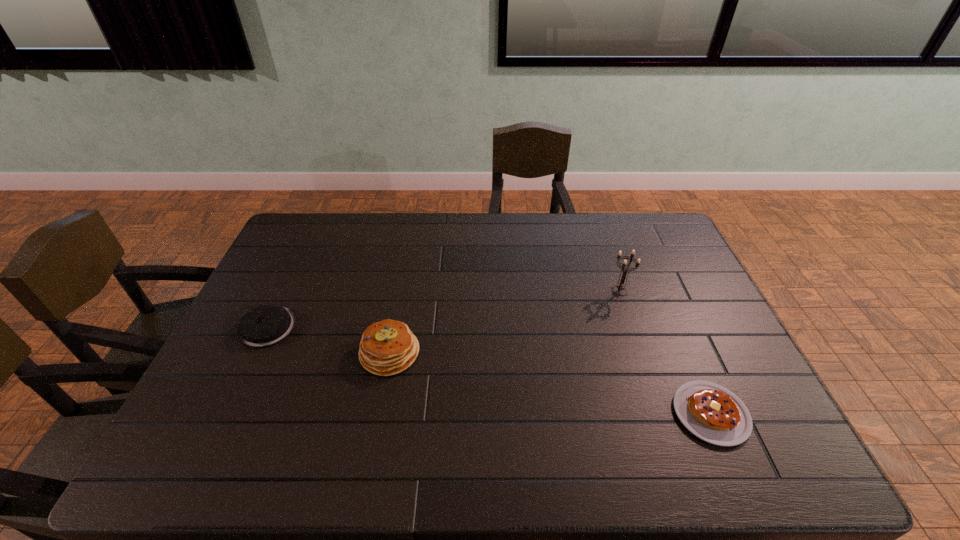
In the image, there is a desktop. Where is `free space at the far left corner`? This screenshot has height=540, width=960. free space at the far left corner is located at coordinates tap(319, 215).

The width and height of the screenshot is (960, 540). I want to click on vacant position at the near right corner of the desktop, so click(748, 455).

At what (x,y) coordinates should I click in order to perform the action: click on free area in between the nearest object and the farthest object. Please return your answer as a coordinate pair (x, y). Looking at the image, I should click on (665, 353).

At what (x,y) coordinates should I click in order to perform the action: click on vacant point located between the second tallest pancake and the second tallest object. Please return your answer as a coordinate pair (x, y). This screenshot has width=960, height=540. Looking at the image, I should click on (329, 340).

Where is `blank region between the farthest object and the second pancake from right to left`? This screenshot has width=960, height=540. blank region between the farthest object and the second pancake from right to left is located at coordinates point(505,322).

Locate an element on the screen. The width and height of the screenshot is (960, 540). free space between the leftmost object and the tallest pancake is located at coordinates (329, 340).

Locate an element on the screen. This screenshot has width=960, height=540. vacant space that is in between the second object from right to left and the leftmost pancake is located at coordinates (444, 309).

You are a GUI agent. You are given a task and a screenshot of the screen. Output one action in this format:
    pyautogui.click(x=<x>, y=<y>)
    Task: Click on the free space between the second pancake from left to right and the candle holder
    The height and width of the screenshot is (540, 960).
    Given the screenshot: What is the action you would take?
    pyautogui.click(x=505, y=322)

What are the coordinates of `vacant space that's between the third tallest object and the second object from right to left` in the screenshot? It's located at (444, 309).

Where is `empty space between the second pancake from right to left and the farthest object`? Image resolution: width=960 pixels, height=540 pixels. empty space between the second pancake from right to left and the farthest object is located at coordinates (505, 322).